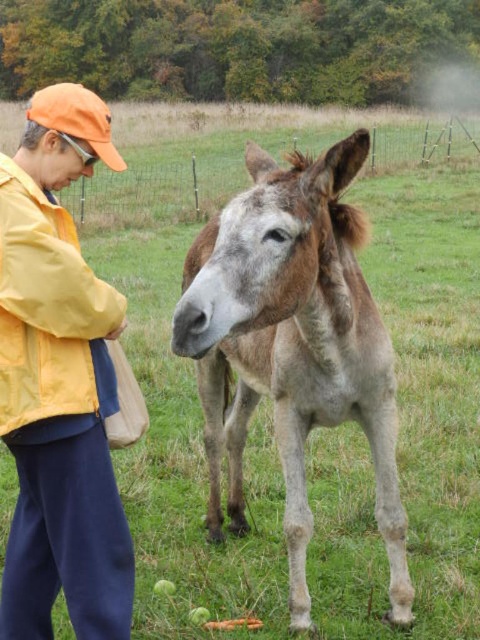
Question: Which point is closer to the camera?

Choices:
 (A) fuzzy brown donkey at center
 (B) orange fabric cap at upper left

Answer: (A)

Question: Which point is closer to the camera?

Choices:
 (A) orange fabric cap at upper left
 (B) fuzzy brown donkey at center

Answer: (B)

Question: Does fuzzy brown donkey at center appear under orange fabric cap at upper left?

Choices:
 (A) yes
 (B) no

Answer: (B)

Question: Which point is farther from the camera taking this photo?

Choices:
 (A) (171, 336)
 (B) (57, 298)

Answer: (A)

Question: Does fuzzy brown donkey at center appear over orange fabric cap at upper left?

Choices:
 (A) yes
 (B) no

Answer: (A)

Question: Does fuzzy brown donkey at center come in front of orange fabric cap at upper left?

Choices:
 (A) no
 (B) yes

Answer: (B)